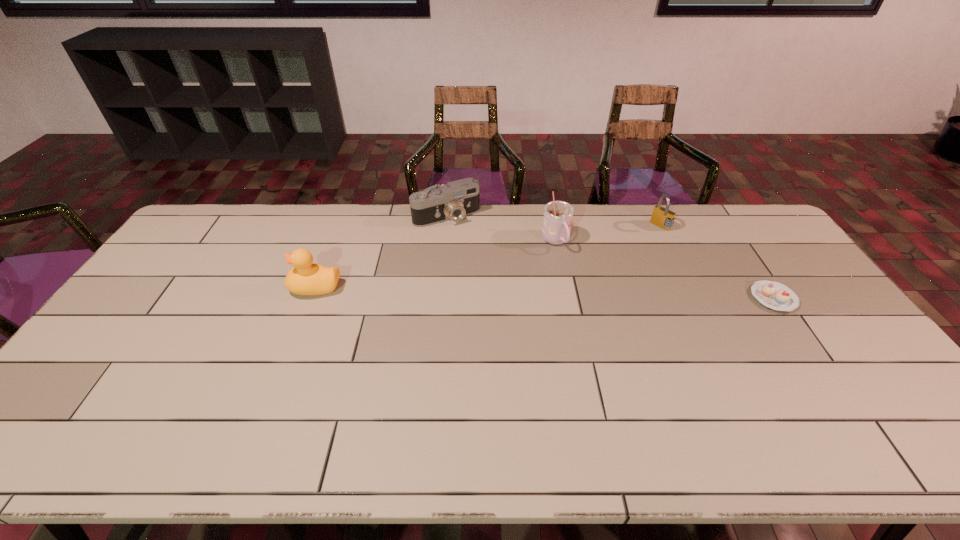
Where is `free space that satisfies the following two spatial constraints: 1. on the front side of the fourth object from right to left; 2. on the right side of the fourth object from left to right`? free space that satisfies the following two spatial constraints: 1. on the front side of the fourth object from right to left; 2. on the right side of the fourth object from left to right is located at coordinates tap(445, 226).

The width and height of the screenshot is (960, 540). In order to click on free space that satisfies the following two spatial constraints: 1. on the front side of the padlock; 2. on the right side of the cupcake in this screenshot , I will do `click(696, 298)`.